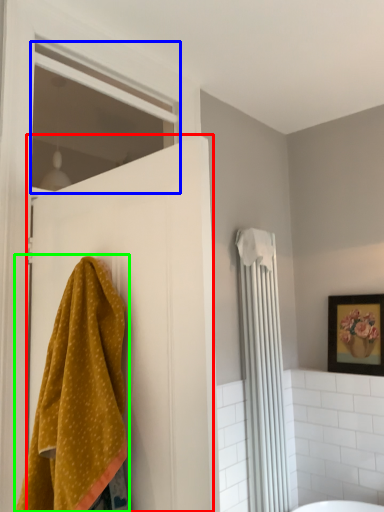
Question: Which object is the farthest from door (highlighted by a red box)? Choose among these: window (highlighted by a blue box) or towel (highlighted by a green box).

Choices:
 (A) window
 (B) towel

Answer: (A)